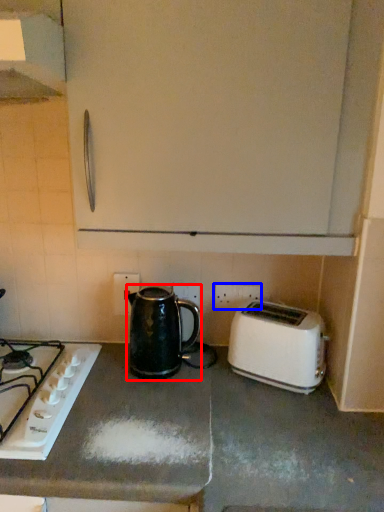
Question: Which point is closer to the camera, kettle (highlighted by a red box) or electric outlet (highlighted by a blue box)?

Choices:
 (A) kettle
 (B) electric outlet

Answer: (A)